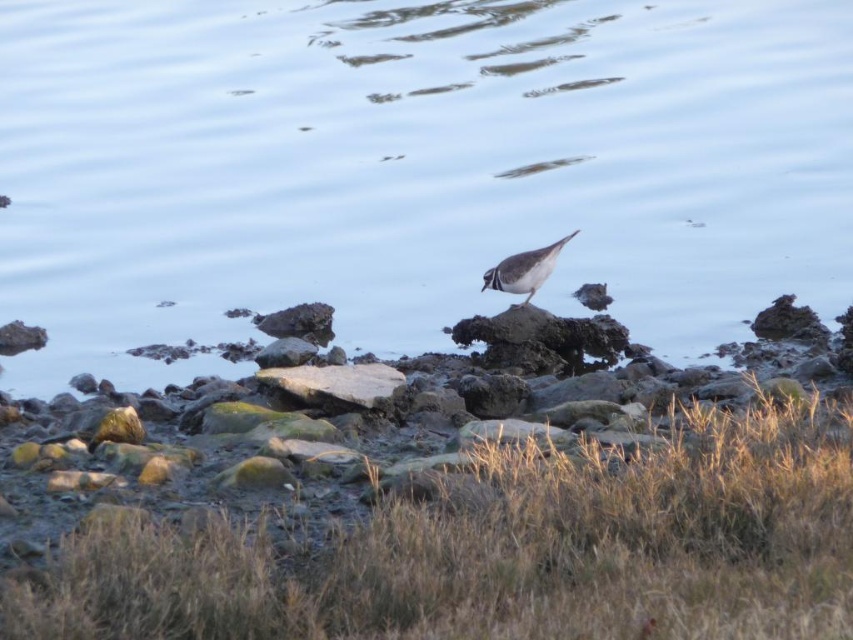
You are a photographer trying to capture the brown speckled feathers at center and the rough textured rock at center in the same frame. Based on their positions, which object would appear closer to the camera?

The rough textured rock at center is located below the brown speckled feathers at center, so the brown speckled feathers at center would appear closer to the camera since it is positioned above the rock.